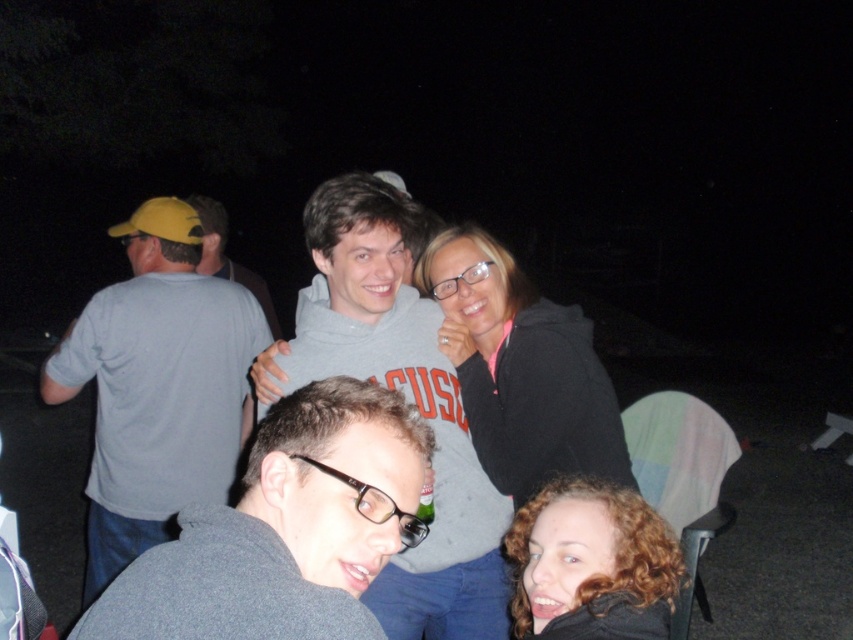
Does gray matte sweater at lower center appear on the left side of gray cotton t-shirt at left?

In fact, gray matte sweater at lower center is to the right of gray cotton t-shirt at left.

Is point (251, 465) farther from viewer compared to point (212, 404)?

No, it is in front of (212, 404).

Between point (337, 481) and point (90, 308), which one is positioned in front?

Point (337, 481)

This screenshot has width=853, height=640. I want to click on gray matte sweater at lower center, so click(285, 529).

In the scene shown: Does gray cotton t-shirt at left have a smaller size compared to black matte jacket at center?

No, gray cotton t-shirt at left is not smaller than black matte jacket at center.

Identify the location of gray cotton t-shirt at left. (157, 387).

Who is more distant from viewer, [399,612] or [677,579]?

The point [399,612] is behind.

Between gray matte hoodie at center and curly hair at lower right, which one is positioned higher?

Positioned higher is gray matte hoodie at center.

This screenshot has width=853, height=640. What do you see at coordinates (405, 397) in the screenshot? I see `gray matte hoodie at center` at bounding box center [405, 397].

Locate an element on the screen. Image resolution: width=853 pixels, height=640 pixels. gray matte hoodie at center is located at coordinates (405, 397).